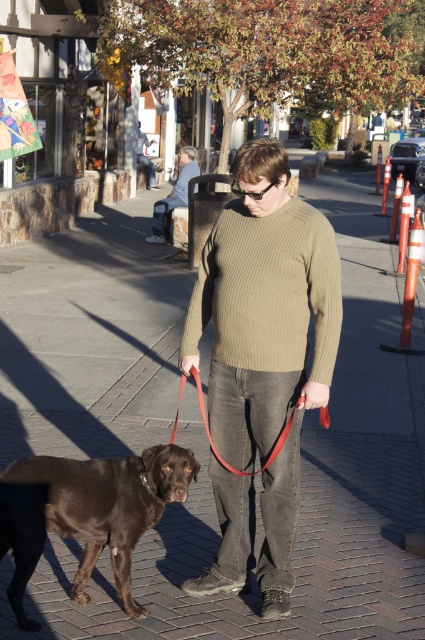
Looking at this image, does knit sweater at center have a larger size compared to red leather leash at center?

Yes.

Can you confirm if knit sweater at center is positioned to the right of red leather leash at center?

Answer: Indeed, knit sweater at center is positioned on the right side of red leather leash at center.

Is point (251, 296) behind point (278, 444)?

Yes, it is.

Where is `knit sweater at center`? knit sweater at center is located at coordinates (266, 339).

Between point (159, 198) and point (142, 154), which one is positioned behind?

The point (142, 154) is behind.

Is gray fabric jacket at upper center to the right of matte brown sweater at center from the viewer's perspective?

Indeed, gray fabric jacket at upper center is positioned on the right side of matte brown sweater at center.

Who is more forward, (161,205) or (138,156)?

Positioned in front is point (161,205).

This screenshot has height=640, width=425. What are the coordinates of `gray fabric jacket at upper center` in the screenshot? It's located at (175, 193).

Between knit sweater at center and olive ribbed sweater at center, which one appears on the left side from the viewer's perspective?

Positioned to the left is knit sweater at center.

Which is behind, point (217, 321) or point (215, 260)?

Positioned behind is point (215, 260).

At what (x,y) coordinates should I click in order to perform the action: click on knit sweater at center. Please return your answer as a coordinate pair (x, y). Image resolution: width=425 pixels, height=640 pixels. Looking at the image, I should click on (266, 339).